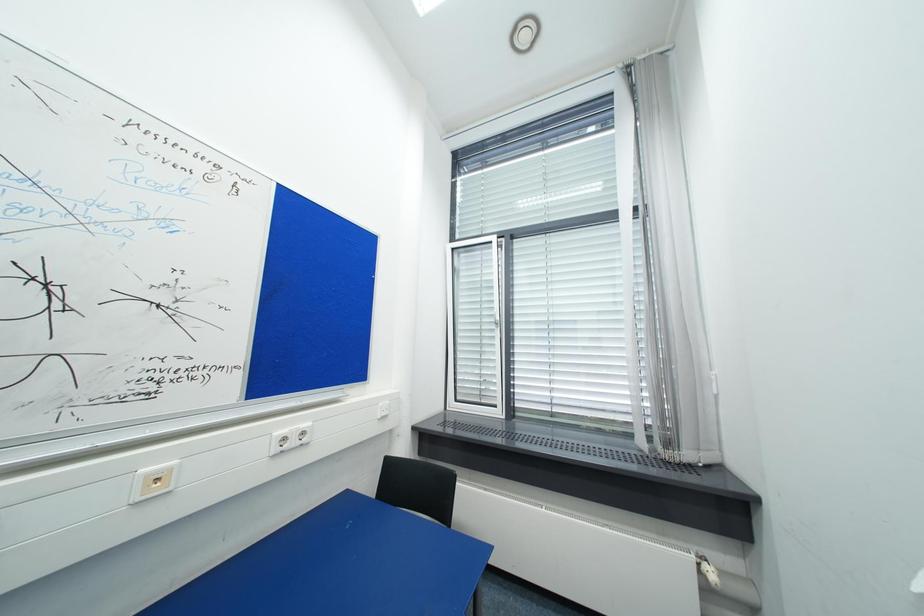
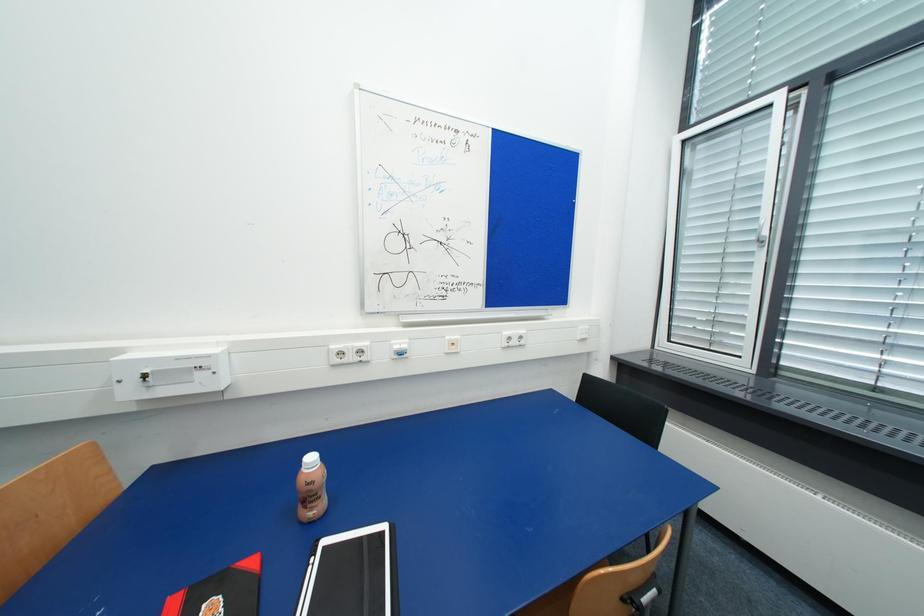
Question: The camera is either moving clockwise (left) or counter-clockwise (right) around the object. The first image is from the beginning of the video and the second image is from the end. Is the camera moving left or right when shooting the video?

Choices:
 (A) Left
 (B) Right

Answer: (B)